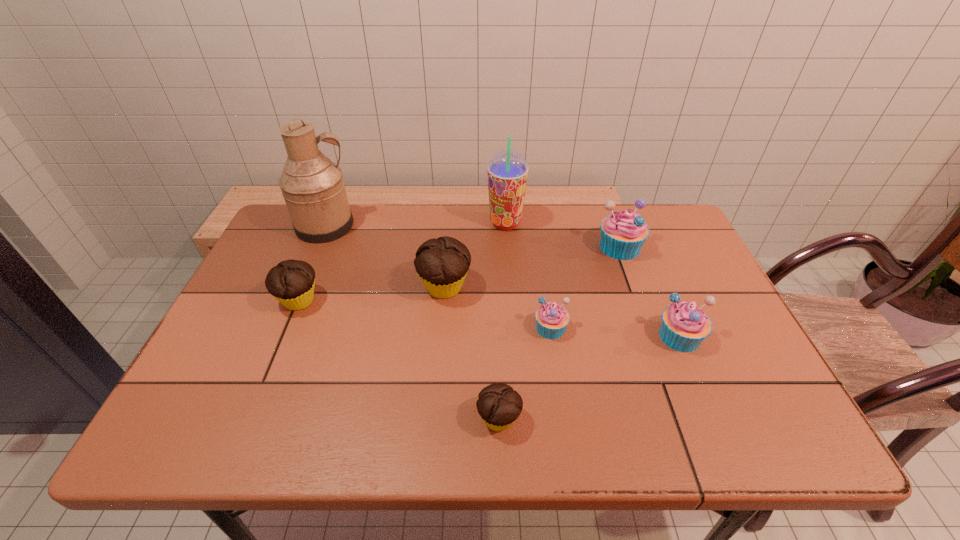
This screenshot has height=540, width=960. Identify the location of the tallest object. (313, 188).

Identify the location of the second tallest object. (507, 170).

Where is `the farthest muffin`? This screenshot has width=960, height=540. the farthest muffin is located at coordinates (623, 233).

You are a GUI agent. You are given a task and a screenshot of the screen. Output one action in this format:
    pyautogui.click(x=<x>, y=<y>)
    Task: Click on the biggest blue muffin
    Image resolution: width=960 pixels, height=540 pixels.
    Given the screenshot: What is the action you would take?
    pyautogui.click(x=623, y=233)

This screenshot has height=540, width=960. Find the location of `the fifth muffin from right to left`. the fifth muffin from right to left is located at coordinates (442, 264).

Find the location of a particular element. This screenshot has width=960, height=540. the second chocolate muffin from right to left is located at coordinates (442, 264).

This screenshot has width=960, height=540. In order to click on the second biggest blue muffin in this screenshot , I will do `click(684, 326)`.

You are a GUI agent. You are given a task and a screenshot of the screen. Output one action in this format:
    pyautogui.click(x=<x>, y=<y>)
    Task: Click on the leftmost chocolate muffin
    This screenshot has width=960, height=540.
    Given the screenshot: What is the action you would take?
    coord(291,282)

Image resolution: width=960 pixels, height=540 pixels. In order to click on the leftmost muffin in this screenshot , I will do `click(291, 282)`.

At what (x,y) coordinates should I click in order to perform the action: click on the smallest blue muffin. Please return your answer as a coordinate pair (x, y). The image size is (960, 540). Looking at the image, I should click on (552, 319).